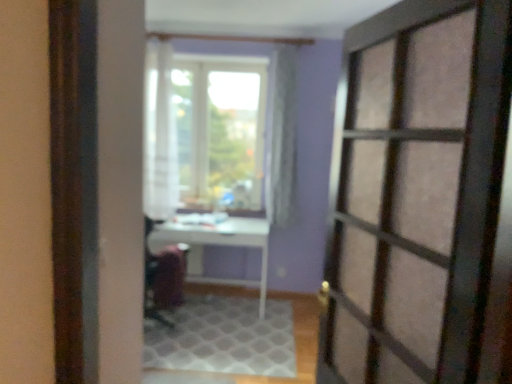
Question: From a real-world perspective, is white glossy table at center physically above white textured rug at center?

Choices:
 (A) no
 (B) yes

Answer: (B)

Question: Is there a large distance between white glossy table at center and white textured rug at center?

Choices:
 (A) no
 (B) yes

Answer: (A)

Question: Can you confirm if white glossy table at center is thinner than white textured rug at center?

Choices:
 (A) no
 (B) yes

Answer: (B)

Question: Can you confirm if white glossy table at center is shorter than white textured rug at center?

Choices:
 (A) no
 (B) yes

Answer: (A)

Question: Considering the relative sizes of white glossy table at center and white textured rug at center in the image provided, is white glossy table at center bigger than white textured rug at center?

Choices:
 (A) no
 (B) yes

Answer: (B)

Question: From the image's perspective, is white glossy table at center over white textured rug at center?

Choices:
 (A) yes
 (B) no

Answer: (A)

Question: Is velvet-like burgundy armchair at center located outside white sheer curtain at center?

Choices:
 (A) yes
 (B) no

Answer: (A)

Question: Is velvet-like burgundy armchair at center bigger than white sheer curtain at center?

Choices:
 (A) no
 (B) yes

Answer: (A)

Question: Can you confirm if velvet-like burgundy armchair at center is taller than white sheer curtain at center?

Choices:
 (A) yes
 (B) no

Answer: (B)

Question: From a real-world perspective, is velvet-like burgundy armchair at center below white sheer curtain at center?

Choices:
 (A) yes
 (B) no

Answer: (A)

Question: Is velvet-like burgundy armchair at center looking in the opposite direction of white sheer curtain at center?

Choices:
 (A) no
 (B) yes

Answer: (A)

Question: Does velvet-like burgundy armchair at center have a lesser width compared to white sheer curtain at center?

Choices:
 (A) yes
 (B) no

Answer: (B)

Question: Does velvet-like burgundy armchair at center lie in front of white textured rug at center?

Choices:
 (A) yes
 (B) no

Answer: (B)